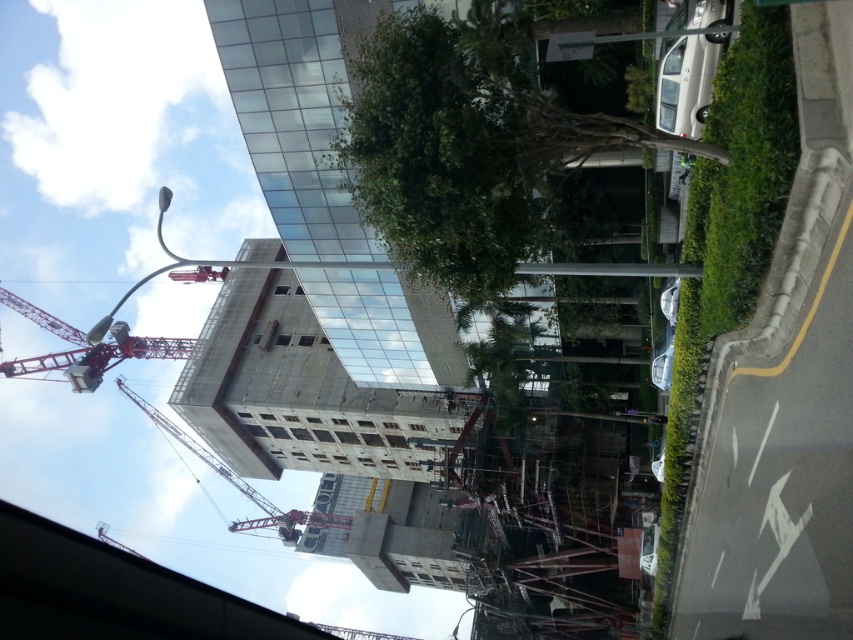
You are standing at the construction site and see the point marked at coordinates (x=440, y=148). What object does this point correspond to in the scene?

The point at coordinates (x=440, y=148) corresponds to the green leafy tree at upper center.

You are a drone operator tasked with capturing aerial footage of the construction site. You need to ensure that the green leafy tree at upper center does not obstruct the view of the building under construction. Based on its coordinates, can you determine if the tree is positioned in a way that might block the camera angle from above?

The green leafy tree at upper center is located at coordinates point (440, 148), which places it at the upper center of the image. Since the tree is positioned at the upper part of the scene, it might obstruct the aerial view of the construction site below, depending on the camera angle and elevation. To avoid obstruction, adjust the drone altitude or angle to ensure the tree does not block the building under construction.

You are a construction worker who needs to move a 40 feet long beam from the red metallic crane at upper left to the red metal crane at center. Can you safely transport the beam between them without it touching the ground?

The distance between the red metallic crane at upper left and the red metal crane at center is 41.06 feet. Since the beam is 40 feet long, it can be transported between them without touching the ground as the beam is shorter than the distance between the two cranes.